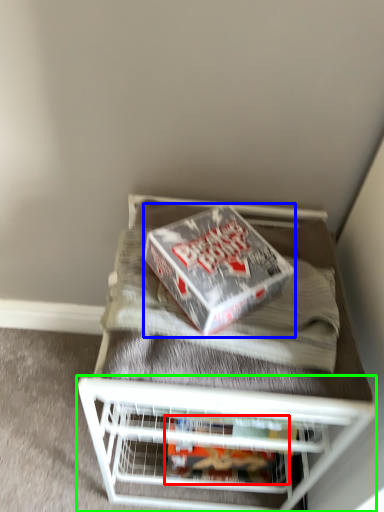
Question: Which is nearer to the package (highlighted by a red box)? box (highlighted by a blue box) or shelf (highlighted by a green box).

Choices:
 (A) box
 (B) shelf

Answer: (B)